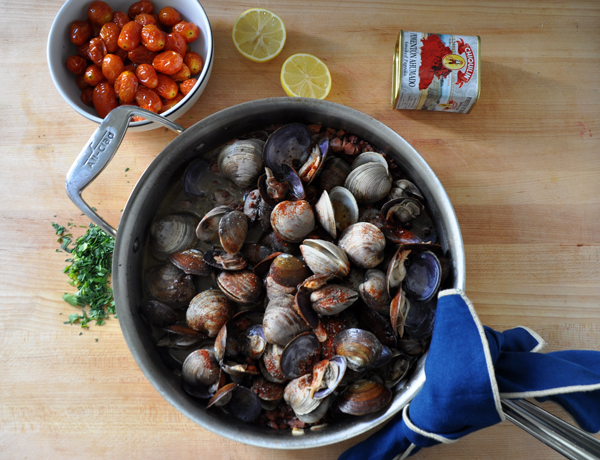
Image resolution: width=600 pixels, height=460 pixels. I want to click on all-clad handle of pot, so click(x=542, y=423).